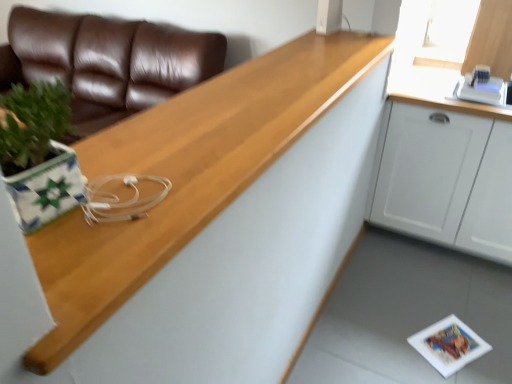
The height and width of the screenshot is (384, 512). In order to click on white matte cabinet at upper right in this screenshot , I will do pos(447,180).

Image resolution: width=512 pixels, height=384 pixels. What do you see at coordinates (205, 227) in the screenshot? I see `wooden at left` at bounding box center [205, 227].

Where is `brown leather couch at upper left`? This screenshot has height=384, width=512. brown leather couch at upper left is located at coordinates click(110, 61).

Can you confirm if brown leather couch at upper left is positioned to the left of wooden at left?

Indeed, brown leather couch at upper left is positioned on the left side of wooden at left.

Can wooden at left be found inside brown leather couch at upper left?

No, brown leather couch at upper left does not contain wooden at left.

Which is in front, point (23, 46) or point (145, 368)?

Point (145, 368)

From the image's perspective, does brown leather couch at upper left appear higher than wooden at left?

Indeed, from the image's perspective, brown leather couch at upper left is shown above wooden at left.

What's the angular difference between wooden at left and white matte cabinet at upper right's facing directions?

89.4 degrees separate the facing orientations of wooden at left and white matte cabinet at upper right.

Is wooden at left next to white matte cabinet at upper right and touching it?

No, wooden at left is not beside white matte cabinet at upper right.

Is wooden at left inside or outside of white matte cabinet at upper right?

wooden at left cannot be found inside white matte cabinet at upper right.

Can you confirm if white matte cabinet at upper right is bigger than wooden at left?

Yes, white matte cabinet at upper right is bigger than wooden at left.

Visually, is white matte cabinet at upper right positioned to the left or to the right of wooden at left?

Clearly, white matte cabinet at upper right is on the right of wooden at left in the image.

From the image's perspective, between white matte cabinet at upper right and wooden at left, which one is located above?

wooden at left, from the image's perspective.

From a real-world perspective, is white matte cabinet at upper right located beneath wooden at left?

Correct, in the physical world, white matte cabinet at upper right is lower than wooden at left.

At what (x,y) coordinates should I click in order to perform the action: click on cabinetry below the brown leather couch at upper left (from the image's perspective). Please return your answer as a coordinate pair (x, y). Image resolution: width=512 pixels, height=384 pixels. Looking at the image, I should click on (447, 180).

Are brown leather couch at upper left and white matte cabinet at upper right far apart?

Absolutely, brown leather couch at upper left is distant from white matte cabinet at upper right.

Considering the sizes of objects brown leather couch at upper left and white matte cabinet at upper right in the image provided, who is bigger, brown leather couch at upper left or white matte cabinet at upper right?

brown leather couch at upper left is bigger.

Does brown leather couch at upper left have a greater width compared to white matte cabinet at upper right?

Yes, brown leather couch at upper left is wider than white matte cabinet at upper right.

Considering the sizes of objects white matte cabinet at upper right and brown leather couch at upper left in the image provided, who is wider, white matte cabinet at upper right or brown leather couch at upper left?

Wider between the two is brown leather couch at upper left.

Considering the relative positions of white matte cabinet at upper right and brown leather couch at upper left in the image provided, is white matte cabinet at upper right to the left of brown leather couch at upper left from the viewer's perspective?

In fact, white matte cabinet at upper right is to the right of brown leather couch at upper left.

What are the coordinates of `cabinetry located on the right of brown leather couch at upper left` in the screenshot? It's located at (447, 180).

Is wooden at left to the left of brown leather couch at upper left from the viewer's perspective?

Incorrect, wooden at left is not on the left side of brown leather couch at upper left.

From the image's perspective, would you say wooden at left is positioned over brown leather couch at upper left?

No, from the image's perspective, wooden at left is not on top of brown leather couch at upper left.

From a real-world perspective, which is physically below, wooden at left or brown leather couch at upper left?

From a 3D spatial view, brown leather couch at upper left is below.

Is wooden at left thinner than brown leather couch at upper left?

Indeed, wooden at left has a lesser width compared to brown leather couch at upper left.

This screenshot has height=384, width=512. Find the location of `studio couch behind the wooden at left`. studio couch behind the wooden at left is located at coordinates (110, 61).

Where is `countertop in front of the white matte cabinet at upper right`? The image size is (512, 384). countertop in front of the white matte cabinet at upper right is located at coordinates (205, 227).

Looking at the image, which one is located closer to white matte cabinet at upper right, wooden at left or brown leather couch at upper left?

wooden at left lies closer to white matte cabinet at upper right than the other object.

When comparing their distances from brown leather couch at upper left, does wooden at left or white matte cabinet at upper right seem closer?

wooden at left is closer to brown leather couch at upper left.

Consider the image. When comparing their distances from wooden at left, does brown leather couch at upper left or white matte cabinet at upper right seem closer?

white matte cabinet at upper right lies closer to wooden at left than the other object.

In the scene shown: Based on their spatial positions, is white matte cabinet at upper right or wooden at left closer to brown leather couch at upper left?

The object closer to brown leather couch at upper left is wooden at left.

Considering their positions, is brown leather couch at upper left positioned further to white matte cabinet at upper right than wooden at left?

Based on the image, brown leather couch at upper left appears to be further to white matte cabinet at upper right.

From the image, which object appears to be nearer to wooden at left, white matte cabinet at upper right or brown leather couch at upper left?

Based on the image, white matte cabinet at upper right appears to be nearer to wooden at left.

Locate an element on the screen. This screenshot has width=512, height=384. countertop between brown leather couch at upper left and white matte cabinet at upper right is located at coordinates (205, 227).